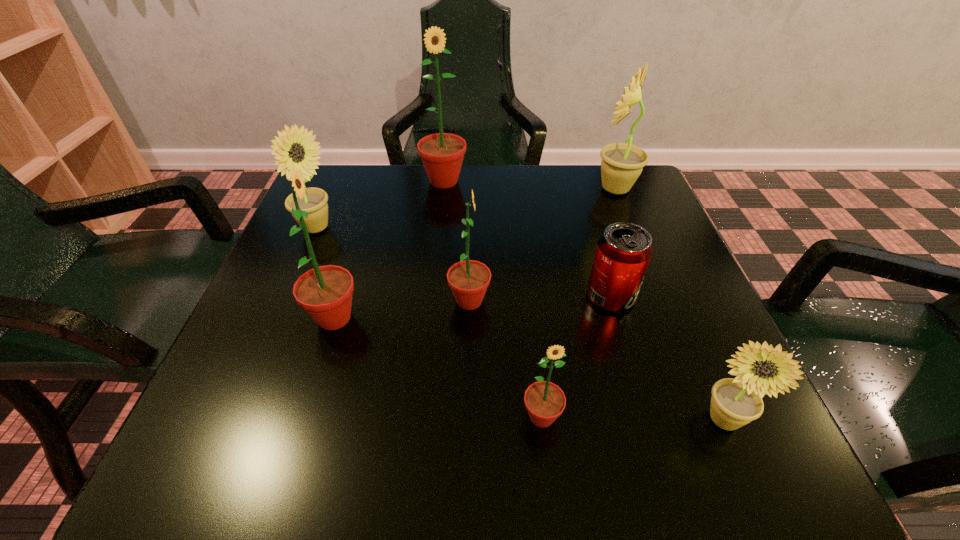
At what (x,y) coordinates should I click in order to perform the action: click on the rightmost green sunflower. Please return your answer as a coordinate pair (x, y). The image size is (960, 540). Looking at the image, I should click on (545, 401).

This screenshot has height=540, width=960. I want to click on the shortest object, so click(x=623, y=252).

Where is `free location located 0.290m on the face of the tallest object`? The width and height of the screenshot is (960, 540). free location located 0.290m on the face of the tallest object is located at coordinates (434, 277).

Image resolution: width=960 pixels, height=540 pixels. In order to click on free space located on the face of the biggest yellow sunflower in this screenshot , I will do `click(511, 189)`.

At what (x,y) coordinates should I click in order to perform the action: click on vacant region located on the face of the biggest yellow sunflower. Please return your answer as a coordinate pair (x, y). Looking at the image, I should click on (454, 189).

In order to click on vacant space situated on the face of the biggest yellow sunflower in this screenshot , I will do `click(567, 189)`.

Locate an element on the screen. This screenshot has width=960, height=540. free space located 0.250m on the face of the leftmost green sunflower is located at coordinates (502, 318).

Find the location of a particular element. free space located on the face of the second biggest yellow sunflower is located at coordinates (459, 228).

This screenshot has height=540, width=960. I want to click on vacant space situated on the face of the second smallest green sunflower, so click(x=653, y=301).

You are a GUI agent. You are given a task and a screenshot of the screen. Output one action in this format:
    pyautogui.click(x=<x>, y=<y>)
    Task: Click on the free spot located on the back of the soda can
    The image size is (960, 540).
    Given the screenshot: What is the action you would take?
    (x=582, y=198)